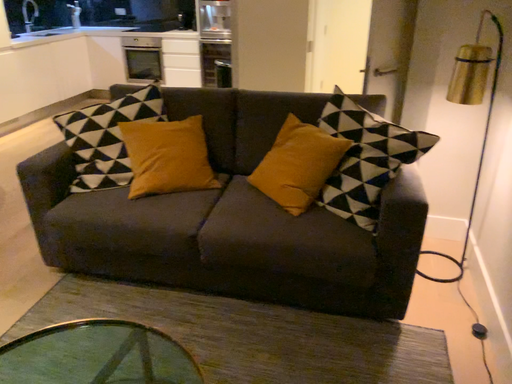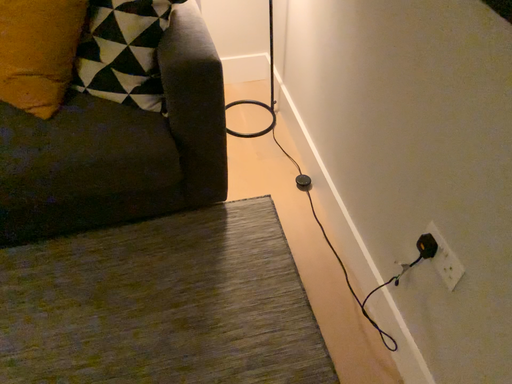
Question: Which way did the camera rotate in the video?

Choices:
 (A) rotated right
 (B) rotated left

Answer: (A)